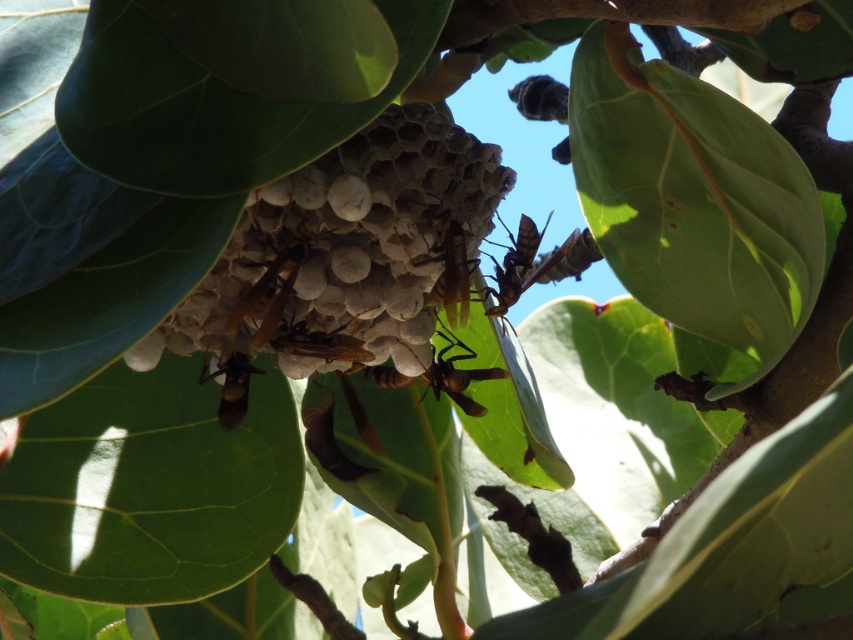
Question: Which point is closer to the camera taking this photo?

Choices:
 (A) (432, 376)
 (B) (547, 220)
 (C) (426, 172)
 (D) (554, 86)

Answer: (C)

Question: Is green matte leaf at center below brown matte wasp at center?

Choices:
 (A) no
 (B) yes

Answer: (A)

Question: Which of the following is the closest to the observer?

Choices:
 (A) (608, 54)
 (B) (520, 248)

Answer: (A)

Question: Is brown matte bee at center positioned in front of shiny black bee at upper center?

Choices:
 (A) no
 (B) yes

Answer: (B)

Question: Which point is farther to the camera?

Choices:
 (A) pyautogui.click(x=689, y=131)
 (B) pyautogui.click(x=264, y=221)
 (C) pyautogui.click(x=283, y=252)
 (D) pyautogui.click(x=556, y=116)

Answer: (D)

Question: Where is white honeycomb at center located in relation to shiny brown bee at center in the image?

Choices:
 (A) above
 (B) below

Answer: (A)